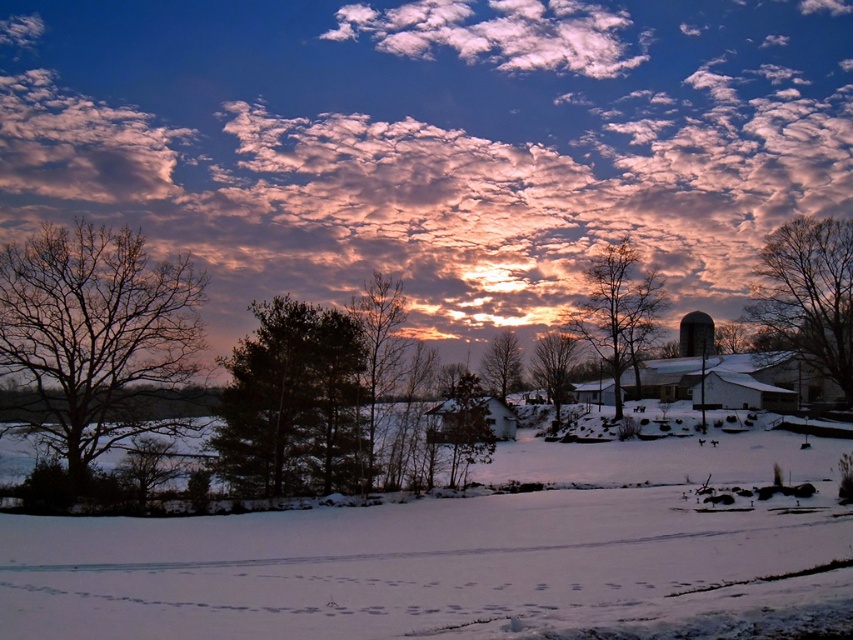
You are an engineer assessing the stability of the metallic silo at right in the winter landscape. Considering the white powdery snow at center, which object occupies more area in the scene?

The white powdery snow at center occupies more area in the scene than the metallic silo at right because it is larger in size.

Where is the white powdery snow at center located in the image?

The white powdery snow at center is located at point (412, 564).

You are an animal trying to cross the snow field. You see the bare branches at left and the dark green textured tree at center. Which one is wider?

The bare branches at left might be wider than dark green textured tree at center according to the description.